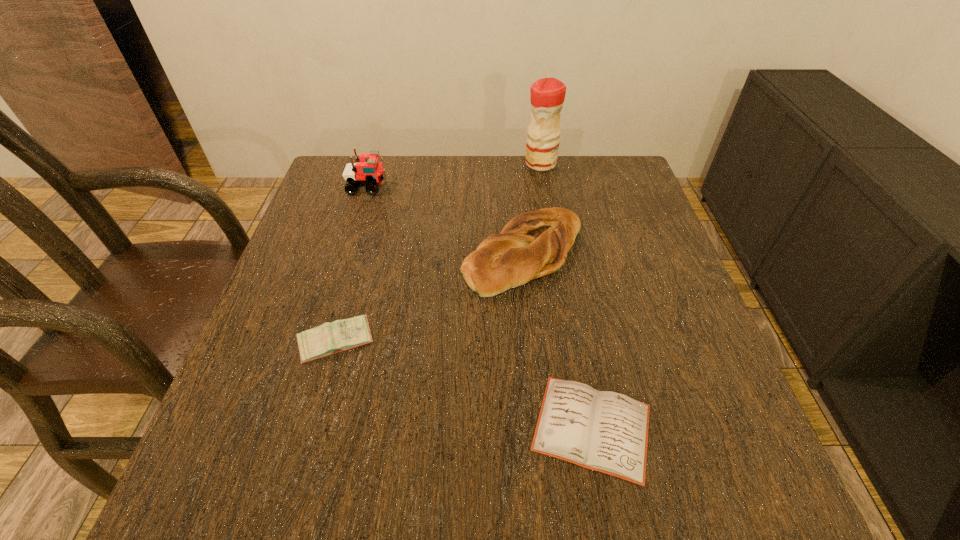
Find the location of a particular element. blank area in the image that satisfies the following two spatial constraints: 1. on the front-facing side of the left diary; 2. on the right side of the second tallest object is located at coordinates (320, 342).

Find the location of `vacant area in the image that satisfies the following two spatial constraints: 1. on the front-facing side of the fourth nearest object; 2. on the back side of the taller diary`. vacant area in the image that satisfies the following two spatial constraints: 1. on the front-facing side of the fourth nearest object; 2. on the back side of the taller diary is located at coordinates coord(320,342).

Identify the location of free space that satisfies the following two spatial constraints: 1. on the front-facing side of the shortest object; 2. on the right side of the second farthest object. Image resolution: width=960 pixels, height=540 pixels. [294, 427].

Where is `vacant space that satisfies the following two spatial constraints: 1. on the front-facing side of the Lego; 2. on the back side of the second nearest object`? This screenshot has height=540, width=960. vacant space that satisfies the following two spatial constraints: 1. on the front-facing side of the Lego; 2. on the back side of the second nearest object is located at coordinates (320, 342).

At what (x,y) coordinates should I click in order to perform the action: click on vacant region that satisfies the following two spatial constraints: 1. on the front-facing side of the Lego; 2. on the back side of the third tallest object. Please return your answer as a coordinate pair (x, y). Looking at the image, I should click on (347, 254).